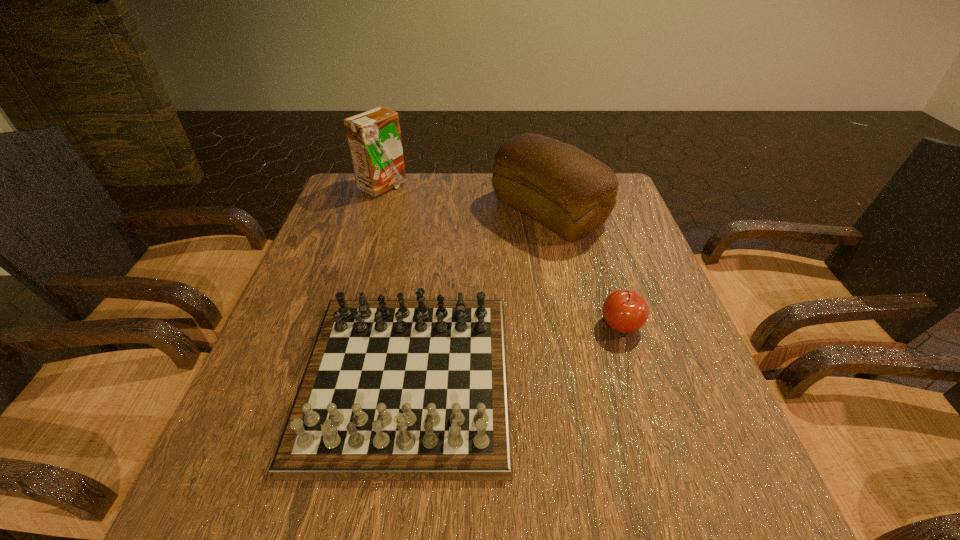
Locate an element on the screen. object present at the near edge is located at coordinates pyautogui.click(x=394, y=390).

Locate an element on the screen. The image size is (960, 540). carton that is at the left edge is located at coordinates (374, 138).

The height and width of the screenshot is (540, 960). What are the coordinates of `chessboard at the left edge` in the screenshot? It's located at (394, 390).

The height and width of the screenshot is (540, 960). Identify the location of bread present at the right edge. (570, 192).

The image size is (960, 540). I want to click on apple present at the right edge, so click(625, 311).

Locate an element on the screen. Image resolution: width=960 pixels, height=540 pixels. object at the far left corner is located at coordinates [374, 138].

Locate an element on the screen. Image resolution: width=960 pixels, height=540 pixels. object that is at the near left corner is located at coordinates (394, 390).

Where is `object that is at the far right corner`? object that is at the far right corner is located at coordinates (570, 192).

You are a GUI agent. You are given a task and a screenshot of the screen. Output one action in this format:
    pyautogui.click(x=<x>, y=<y>)
    Task: Click on the free space at the far edge of the desktop
    
    Given the screenshot: What is the action you would take?
    pyautogui.click(x=473, y=190)

Where is `free space at the near edge of the desktop`? The width and height of the screenshot is (960, 540). free space at the near edge of the desktop is located at coordinates (625, 537).